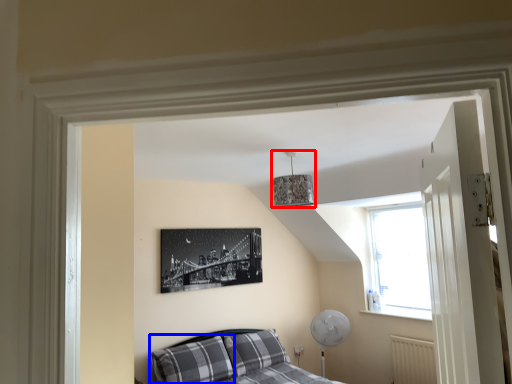
Question: Among these objects, which one is farthest to the camera, lamp (highlighted by a red box) or pillow (highlighted by a blue box)?

Choices:
 (A) lamp
 (B) pillow

Answer: (B)